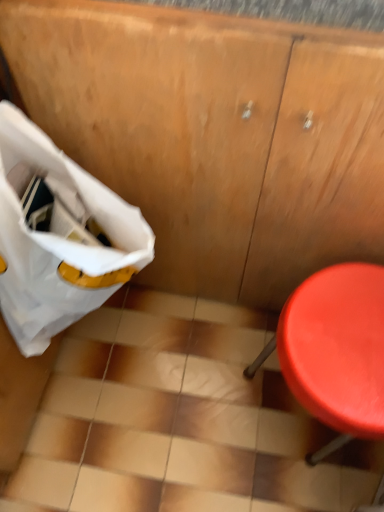
Question: In the image, is smooth plastic stool at right positioned in front of or behind white fabric bag at left?

Choices:
 (A) behind
 (B) front

Answer: (A)

Question: Considering the positions of point (304, 396) and point (96, 252), is point (304, 396) closer or farther from the camera than point (96, 252)?

Choices:
 (A) closer
 (B) farther

Answer: (B)

Question: From a real-world perspective, is smooth plastic stool at right positioned above or below white fabric bag at left?

Choices:
 (A) below
 (B) above

Answer: (A)

Question: Would you say white fabric bag at left is to the left or to the right of smooth plastic stool at right in the picture?

Choices:
 (A) left
 (B) right

Answer: (A)

Question: Considering the positions of white fabric bag at left and smooth plastic stool at right in the image, is white fabric bag at left taller or shorter than smooth plastic stool at right?

Choices:
 (A) tall
 (B) short

Answer: (A)

Question: Based on their sizes in the image, would you say white fabric bag at left is bigger or smaller than smooth plastic stool at right?

Choices:
 (A) small
 (B) big

Answer: (A)

Question: Considering the positions of white fabric bag at left and smooth plastic stool at right in the image, is white fabric bag at left wider or thinner than smooth plastic stool at right?

Choices:
 (A) wide
 (B) thin

Answer: (B)